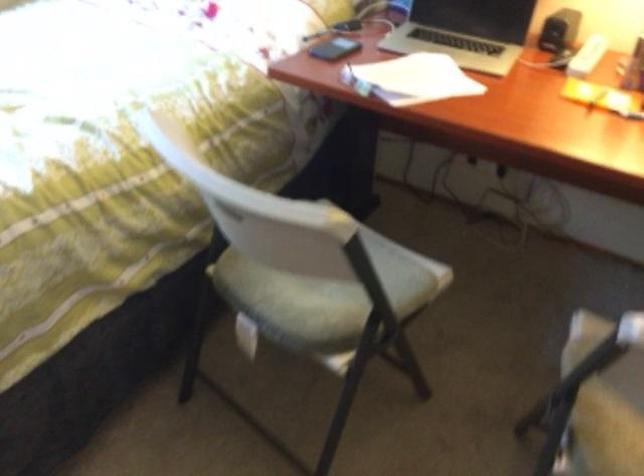
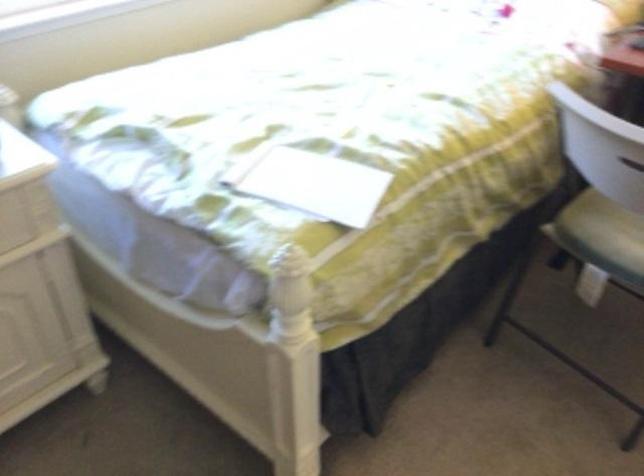
Question: The camera is either moving clockwise (left) or counter-clockwise (right) around the object. The first image is from the beginning of the video and the second image is from the end. Is the camera moving left or right when shooting the video?

Choices:
 (A) Left
 (B) Right

Answer: (B)